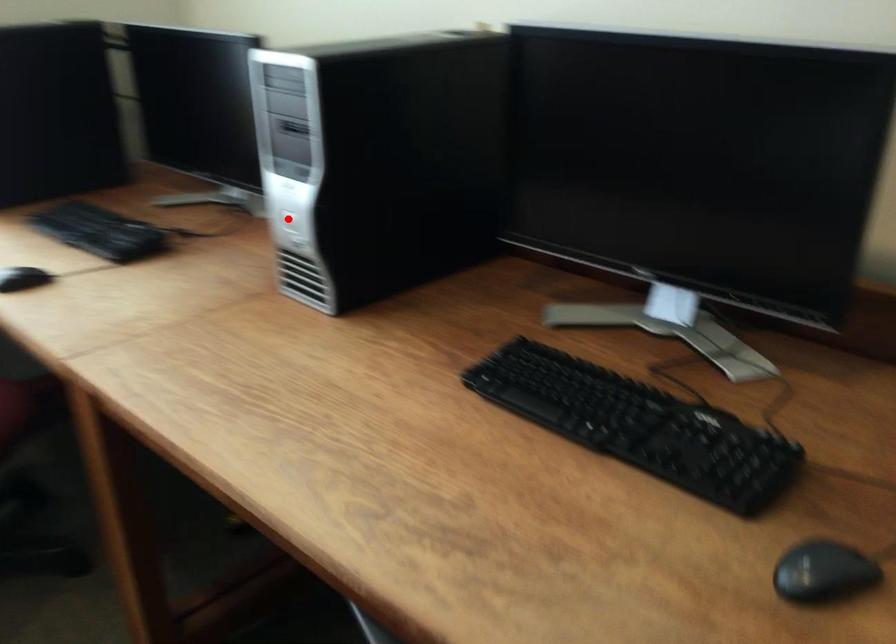
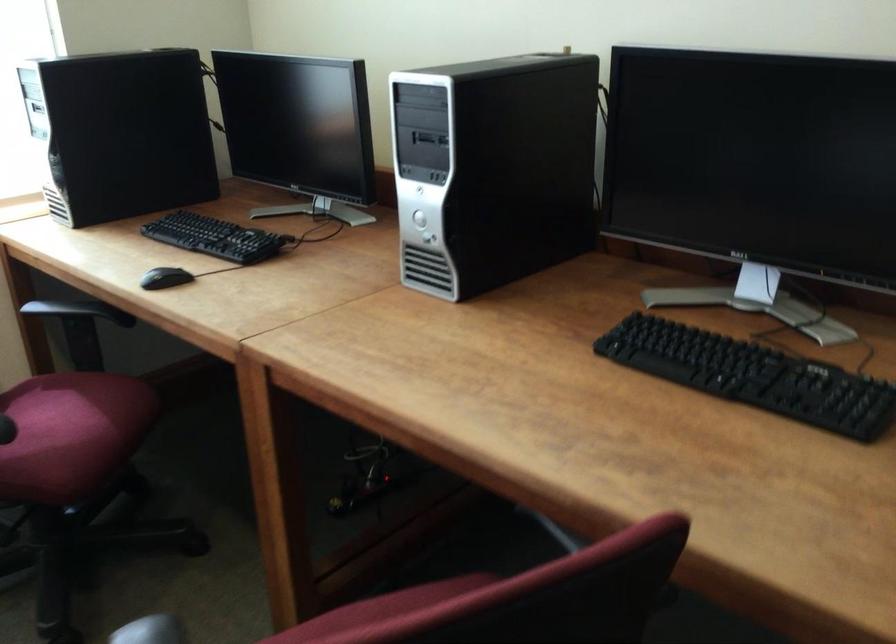
In the second image, find the point that corresponds to the highlighted location in the first image.

(418, 219)